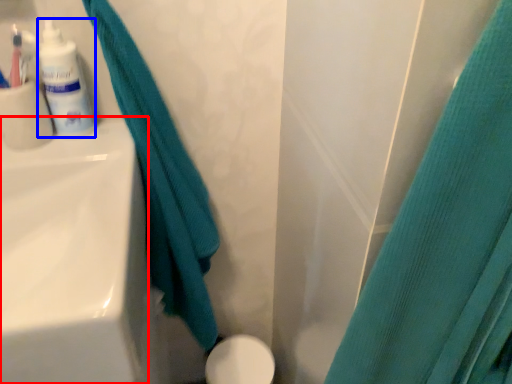
Question: Which of the following is the farthest to the observer, sink (highlighted by a red box) or toiletry (highlighted by a blue box)?

Choices:
 (A) sink
 (B) toiletry

Answer: (B)